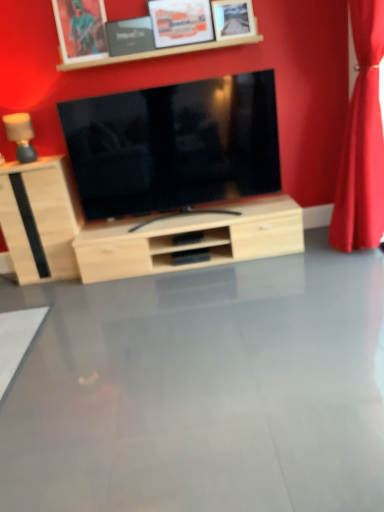
Identify the location of vacant region above wooden frame at upper center (from a real-world perspective). (157, 25).